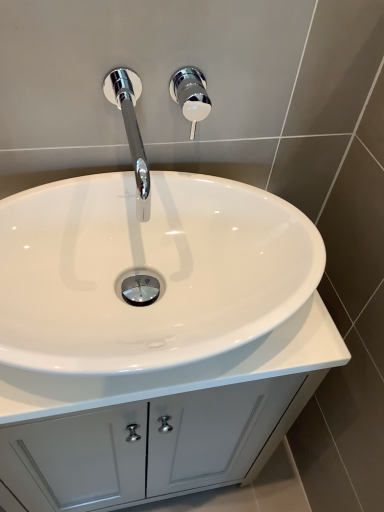
Question: Which direction should I rotate to look at chrome/polished metal shower handle at upper center?

Choices:
 (A) right
 (B) left

Answer: (B)

Question: Is chrome/metallic faucet at upper center surrounding white glossy cabinet at center?

Choices:
 (A) no
 (B) yes

Answer: (A)

Question: Would you say chrome/metallic faucet at upper center is outside white glossy cabinet at center?

Choices:
 (A) yes
 (B) no

Answer: (A)

Question: From a real-world perspective, is chrome/metallic faucet at upper center positioned under white glossy cabinet at center based on gravity?

Choices:
 (A) yes
 (B) no

Answer: (B)

Question: Is chrome/metallic faucet at upper center smaller than white glossy cabinet at center?

Choices:
 (A) no
 (B) yes

Answer: (B)

Question: Considering the relative sizes of chrome/metallic faucet at upper center and white glossy cabinet at center in the image provided, is chrome/metallic faucet at upper center thinner than white glossy cabinet at center?

Choices:
 (A) no
 (B) yes

Answer: (B)

Question: From the image's perspective, is chrome/metallic faucet at upper center below white glossy cabinet at center?

Choices:
 (A) yes
 (B) no

Answer: (B)

Question: Does white glossy cabinet at center have a larger size compared to chrome/metallic faucet at upper center?

Choices:
 (A) no
 (B) yes

Answer: (B)

Question: Considering the relative sizes of white glossy cabinet at center and chrome/metallic faucet at upper center in the image provided, is white glossy cabinet at center shorter than chrome/metallic faucet at upper center?

Choices:
 (A) yes
 (B) no

Answer: (B)

Question: From the image's perspective, does white glossy cabinet at center appear higher than chrome/metallic faucet at upper center?

Choices:
 (A) yes
 (B) no

Answer: (B)

Question: Is white glossy cabinet at center smaller than chrome/metallic faucet at upper center?

Choices:
 (A) no
 (B) yes

Answer: (A)

Question: Considering the relative positions of white glossy cabinet at center and chrome/metallic faucet at upper center in the image provided, is white glossy cabinet at center to the left of chrome/metallic faucet at upper center from the viewer's perspective?

Choices:
 (A) no
 (B) yes

Answer: (B)

Question: Would you consider white glossy cabinet at center to be distant from chrome/metallic faucet at upper center?

Choices:
 (A) yes
 (B) no

Answer: (B)

Question: Is chrome/polished metal shower handle at upper center shorter than white glossy cabinet at center?

Choices:
 (A) no
 (B) yes

Answer: (B)